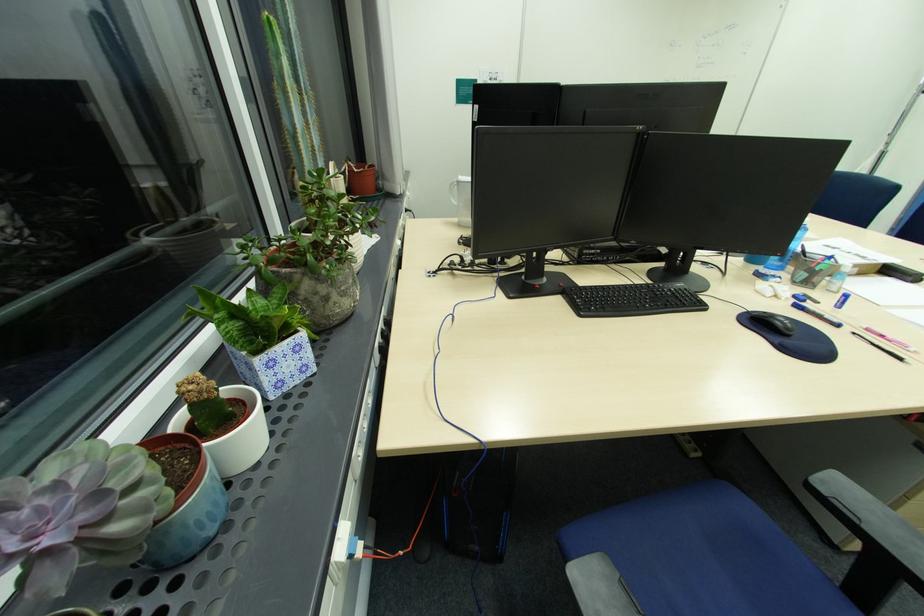
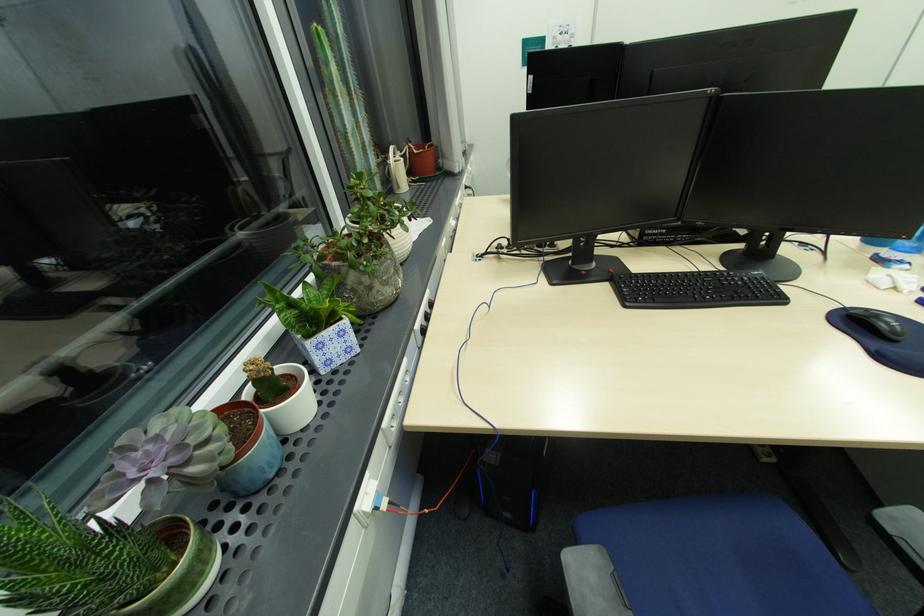
Locate, in the second image, the point that corresponds to (x=199, y=383) in the first image.

(259, 363)